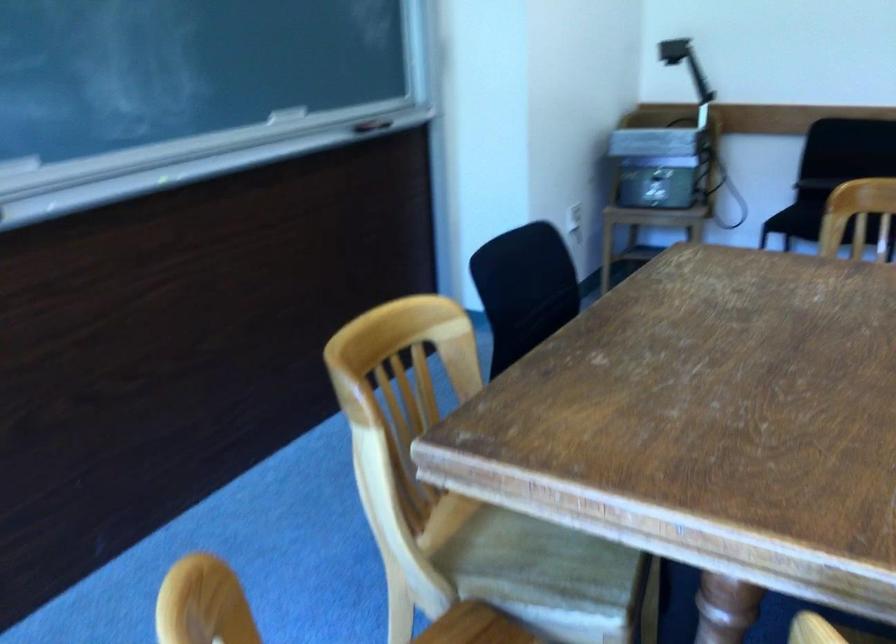
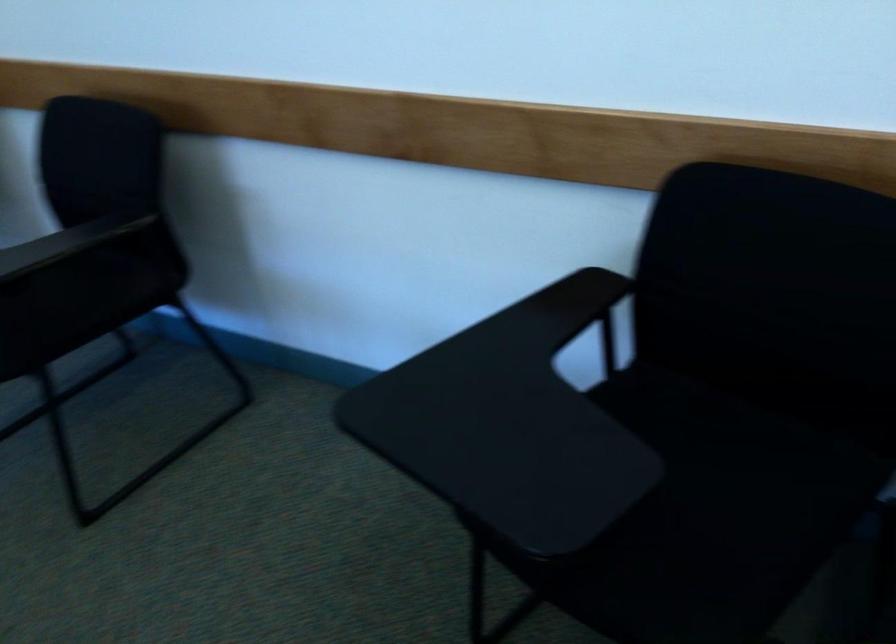
Looking at this image, in a continuous first-person perspective shot, in which direction is the camera moving?

The cameraman walked toward right, forward.